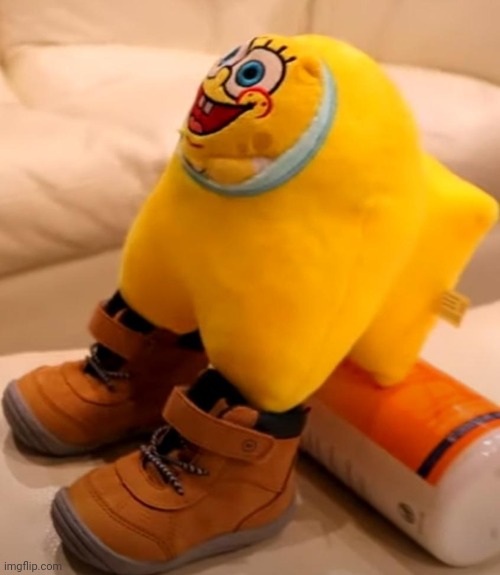
Where is `cushion`? cushion is located at coordinates (98, 168).